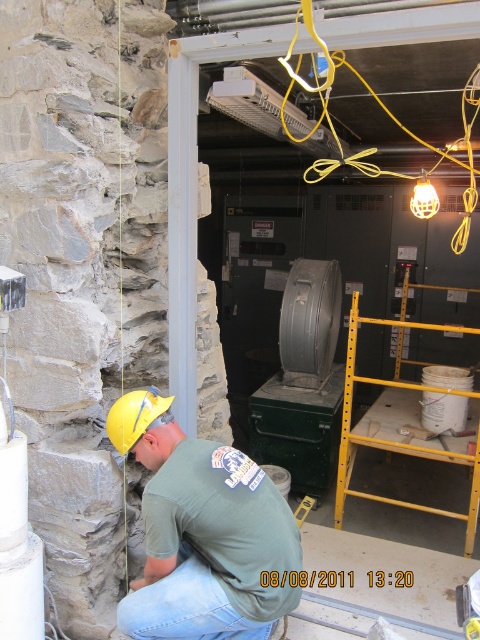
Question: Which of the following is the closest to the observer?

Choices:
 (A) yellow metal ladder at right
 (B) green fabric shirt at lower center

Answer: (B)

Question: Which point is farther to the camera?

Choices:
 (A) (186, 454)
 (B) (338, 483)

Answer: (B)

Question: Can you confirm if green fabric shirt at lower center is positioned to the left of yellow metal ladder at right?

Choices:
 (A) yes
 (B) no

Answer: (A)

Question: Is green fabric shirt at lower center behind yellow metal ladder at right?

Choices:
 (A) yes
 (B) no

Answer: (B)

Question: Can you confirm if green fabric shirt at lower center is smaller than yellow metal ladder at right?

Choices:
 (A) yes
 (B) no

Answer: (A)